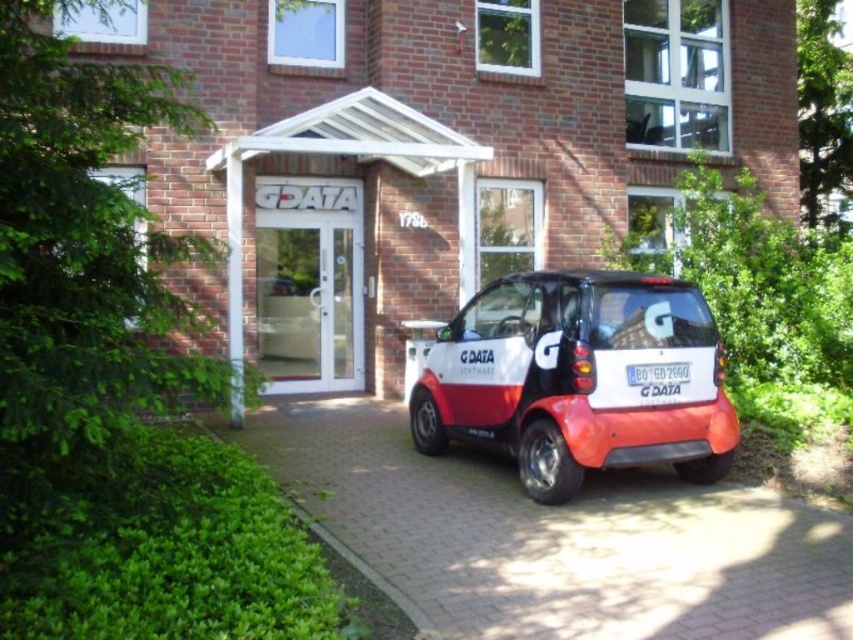
Is matte white and red car at center wider than white glass door at center?

Indeed, matte white and red car at center has a greater width compared to white glass door at center.

Is point (572, 456) closer to viewer compared to point (306, 358)?

That is True.

Find the location of `matte white and red car at center`. matte white and red car at center is located at coordinates [x=578, y=378].

You are a GUI agent. You are given a task and a screenshot of the screen. Output one action in this format:
    pyautogui.click(x=<x>, y=<y>)
    Task: Click on the matte white and red car at center
    
    Given the screenshot: What is the action you would take?
    pyautogui.click(x=578, y=378)

Does white glass door at center have a greater width compared to white plastic license plate at center?

Indeed, white glass door at center has a greater width compared to white plastic license plate at center.

The image size is (853, 640). What do you see at coordinates (309, 284) in the screenshot?
I see `white glass door at center` at bounding box center [309, 284].

Locate an element on the screen. Image resolution: width=853 pixels, height=640 pixels. white glass door at center is located at coordinates (309, 284).

Between point (491, 336) and point (659, 381), which one is positioned in front?

Positioned in front is point (659, 381).

Is matte white and red car at center positioned before white plastic license plate at center?

Yes, it is in front of white plastic license plate at center.

At what (x,y) coordinates should I click in order to perform the action: click on matte white and red car at center. Please return your answer as a coordinate pair (x, y). The width and height of the screenshot is (853, 640). Looking at the image, I should click on pyautogui.click(x=578, y=378).